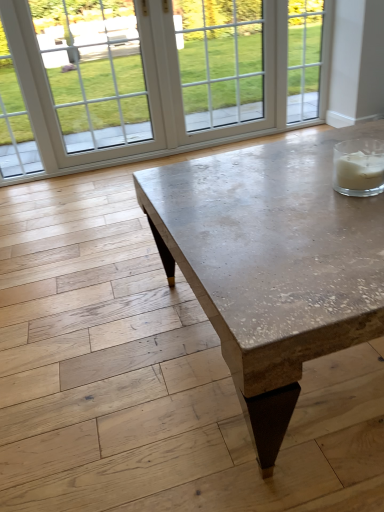
You are a GUI agent. You are given a task and a screenshot of the screen. Output one action in this format:
    pyautogui.click(x=<x>, y=<y>)
    Task: Click on the vacant space that is to the left of matte concrete coffee table at center
    
    Given the screenshot: What is the action you would take?
    pyautogui.click(x=94, y=328)